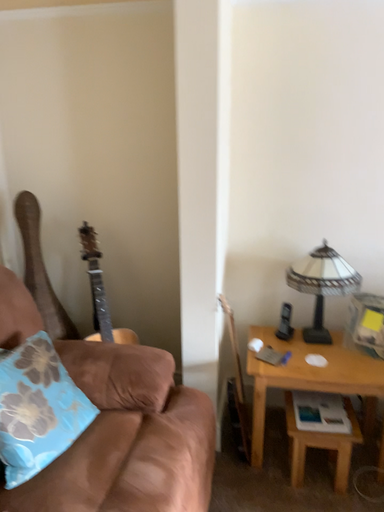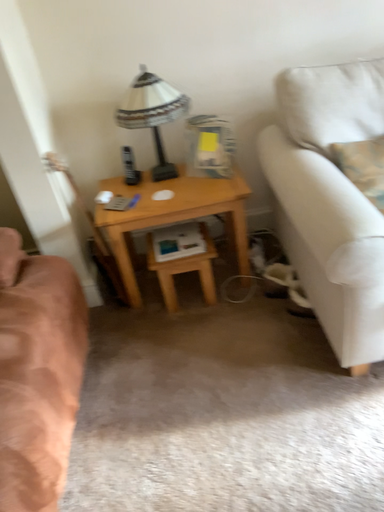
Question: Which way did the camera rotate in the video?

Choices:
 (A) rotated downward
 (B) rotated upward

Answer: (A)